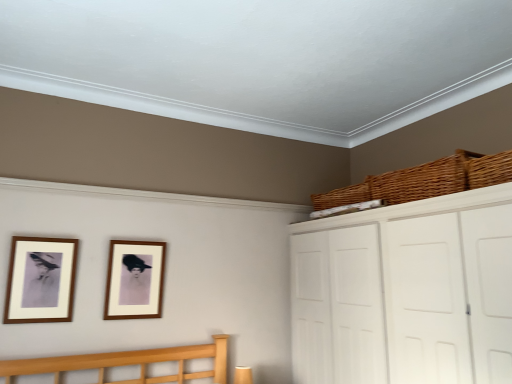
Question: Are woven brown basket at upper right, which appears as the 3th basket when viewed from the front, and woven brown basket at upper right, placed as the second basket when sorted from back to front, beside each other?

Choices:
 (A) yes
 (B) no

Answer: (B)

Question: Is woven brown basket at upper right, which appears as the 3th basket when viewed from the front, to the left of woven brown basket at upper right, placed as the second basket when sorted from back to front, from the viewer's perspective?

Choices:
 (A) yes
 (B) no

Answer: (A)

Question: Is woven brown basket at upper right, marked as the 1th basket in a back-to-front arrangement, closer to camera compared to woven brown basket at upper right, placed as the second basket when sorted from back to front?

Choices:
 (A) yes
 (B) no

Answer: (B)

Question: Would you say woven brown basket at upper right, marked as the 1th basket in a back-to-front arrangement, is outside woven brown basket at upper right, arranged as the second basket when viewed from the front?

Choices:
 (A) yes
 (B) no

Answer: (A)

Question: Considering the relative positions of woven brown basket at upper right, which appears as the 3th basket when viewed from the front, and woven brown basket at upper right, placed as the second basket when sorted from back to front, in the image provided, is woven brown basket at upper right, which appears as the 3th basket when viewed from the front, behind woven brown basket at upper right, placed as the second basket when sorted from back to front,?

Choices:
 (A) yes
 (B) no

Answer: (A)

Question: Is white matte cabinet at upper right wider or thinner than wooden picture frame at center, the second picture frame positioned from the front?

Choices:
 (A) thin
 (B) wide

Answer: (B)

Question: Is white matte cabinet at upper right to the left or to the right of wooden picture frame at center, positioned as the 1th picture frame in right-to-left order, in the image?

Choices:
 (A) left
 (B) right

Answer: (B)

Question: Does point (350, 316) appear closer or farther from the camera than point (144, 281)?

Choices:
 (A) farther
 (B) closer

Answer: (B)

Question: Based on their sizes in the image, would you say white matte cabinet at upper right is bigger or smaller than wooden picture frame at center, positioned as the 1th picture frame in right-to-left order?

Choices:
 (A) big
 (B) small

Answer: (A)

Question: Is matte wood picture frame at left, the first picture frame positioned from the front, spatially inside woven brown basket at upper right, marked as the 1th basket in a back-to-front arrangement, or outside of it?

Choices:
 (A) outside
 (B) inside

Answer: (A)

Question: Looking at their shapes, would you say matte wood picture frame at left, the first picture frame positioned from the front, is wider or thinner than woven brown basket at upper right, which appears as the 3th basket when viewed from the front?

Choices:
 (A) thin
 (B) wide

Answer: (A)

Question: Looking at the image, does matte wood picture frame at left, positioned as the second picture frame in right-to-left order, seem bigger or smaller compared to woven brown basket at upper right, which appears as the 3th basket when viewed from the front?

Choices:
 (A) small
 (B) big

Answer: (A)

Question: Considering the relative positions of matte wood picture frame at left, the first picture frame positioned from the front, and woven brown basket at upper right, which appears as the 3th basket when viewed from the front, in the image provided, is matte wood picture frame at left, the first picture frame positioned from the front, to the left or to the right of woven brown basket at upper right, which appears as the 3th basket when viewed from the front,?

Choices:
 (A) left
 (B) right

Answer: (A)

Question: Is woven brown basket at upper right, placed as the second basket when sorted from back to front, taller or shorter than wooden picture frame at center, the second picture frame positioned from the front?

Choices:
 (A) short
 (B) tall

Answer: (A)

Question: Which is correct: woven brown basket at upper right, arranged as the second basket when viewed from the front, is inside wooden picture frame at center, the first picture frame positioned from the back, or outside of it?

Choices:
 (A) inside
 (B) outside

Answer: (B)